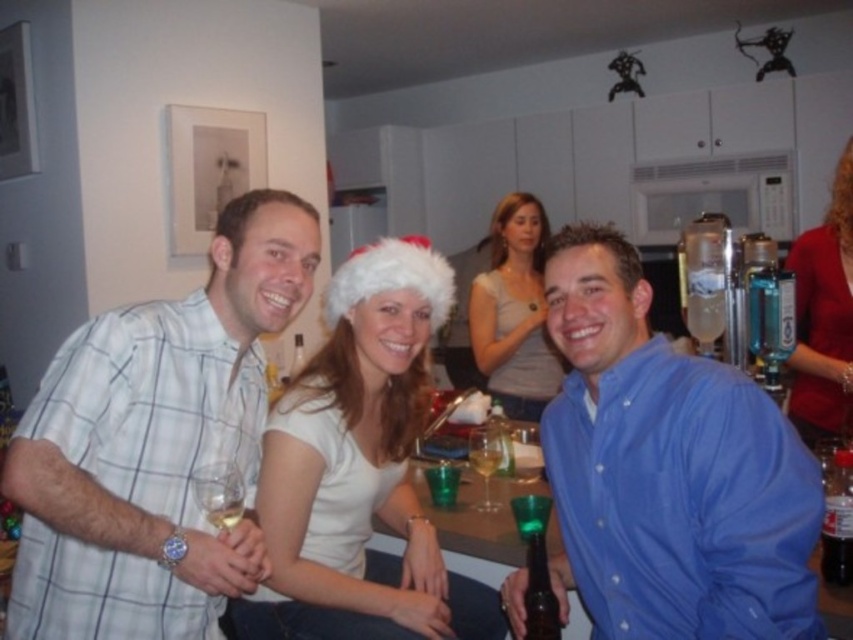
Locate an element on the screen. The height and width of the screenshot is (640, 853). white matte santa hat at upper center is located at coordinates (514, 310).

Does point (519, 280) come behind point (225, 484)?

Yes, point (519, 280) is farther from viewer.

Find the location of `white matte santa hat at upper center`. white matte santa hat at upper center is located at coordinates pyautogui.click(x=514, y=310).

Between point (480, 356) and point (480, 456), which one is positioned in front?

Point (480, 456) is more forward.

From the picture: Does white matte santa hat at upper center have a smaller size compared to translucent glass at center?

No.

Where is `white matte santa hat at upper center`? This screenshot has width=853, height=640. white matte santa hat at upper center is located at coordinates (514, 310).

The image size is (853, 640). I want to click on white matte santa hat at upper center, so click(514, 310).

Which is in front, point (593, 257) or point (850, 150)?

Point (593, 257)

How far apart are blue button-down shirt at center and red velvet sweater at upper right?

blue button-down shirt at center is 1.22 meters from red velvet sweater at upper right.

Describe the element at coordinates (666, 468) in the screenshot. I see `blue button-down shirt at center` at that location.

This screenshot has height=640, width=853. Find the location of `blue button-down shirt at center`. blue button-down shirt at center is located at coordinates coord(666,468).